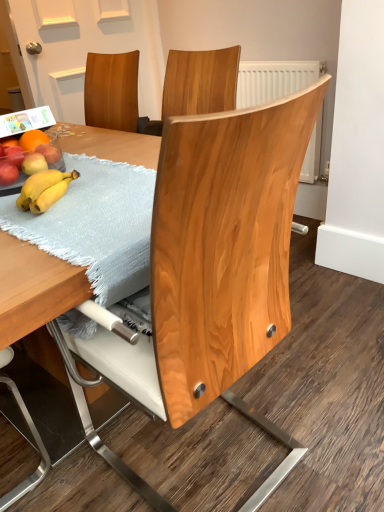
The image size is (384, 512). I want to click on free space to the back side of yellow matte apple at left, arranged as the second apple when viewed from the front, so click(x=76, y=155).